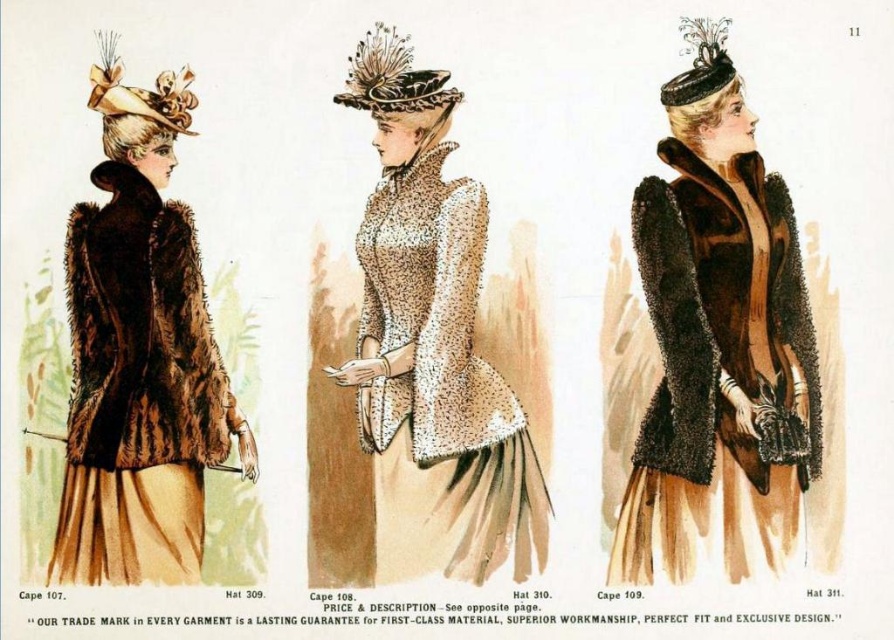
Question: Where is velvet brown cape at center located in relation to black velvet hat at upper center in the image?

Choices:
 (A) below
 (B) above

Answer: (A)

Question: Is speckled woolen dress at center to the right of brown fur coat at left from the viewer's perspective?

Choices:
 (A) yes
 (B) no

Answer: (A)

Question: Is the position of speckled fur coat at center more distant than that of black velvet hat at upper center?

Choices:
 (A) yes
 (B) no

Answer: (B)

Question: Among these points, which one is farthest from the camera?

Choices:
 (A) (502, 496)
 (B) (456, 93)
 (C) (100, 97)

Answer: (C)

Question: Which of the following is the farthest from the observer?

Choices:
 (A) (106, 252)
 (B) (426, 163)
 (C) (417, 77)

Answer: (B)

Question: Among these points, which one is farthest from the camera?

Choices:
 (A) (644, 189)
 (B) (713, 86)
 (C) (382, 72)
 (D) (89, 540)

Answer: (A)